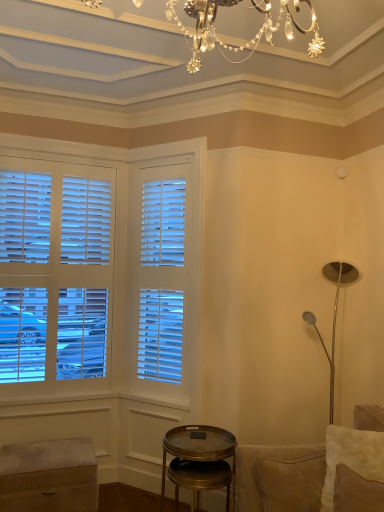
The height and width of the screenshot is (512, 384). Describe the element at coordinates (280, 478) in the screenshot. I see `suede couch at right` at that location.

Locate an element on the screen. metallic gold side table at lower center is located at coordinates (201, 452).

Would you say velvet ottoman at lower left is to the left or to the right of suede couch at right in the picture?

velvet ottoman at lower left is to the left of suede couch at right.

From the image's perspective, would you say velvet ottoman at lower left is positioned over suede couch at right?

No, from the image's perspective, velvet ottoman at lower left is not over suede couch at right.

Is velvet ottoman at lower left situated inside suede couch at right or outside?

The correct answer is: outside.

Choose the correct answer: Is suede couch at right inside velvet ottoman at lower left or outside it?

suede couch at right is spatially situated outside velvet ottoman at lower left.

Between suede couch at right and velvet ottoman at lower left, which one has larger width?

Wider between the two is suede couch at right.

From the picture: From the image's perspective, is suede couch at right under velvet ottoman at lower left?

Incorrect, from the image's perspective, suede couch at right is higher than velvet ottoman at lower left.

How many degrees apart are the facing directions of suede couch at right and velvet ottoman at lower left?

The angular difference between suede couch at right and velvet ottoman at lower left is 89.9 degrees.

Where is `table below the suede couch at right (from the image's perspective)`? This screenshot has height=512, width=384. table below the suede couch at right (from the image's perspective) is located at coordinates (201, 452).

Is metallic gold side table at lower center located within suede couch at right?

That's incorrect, metallic gold side table at lower center is not inside suede couch at right.

Is suede couch at right to the left of metallic gold side table at lower center from the viewer's perspective?

No.

Does suede couch at right touch metallic gold side table at lower center?

No, suede couch at right is not touching metallic gold side table at lower center.

Would you say white fluffy pillow at lower right is outside suede couch at right?

Actually, white fluffy pillow at lower right is within suede couch at right.

From a real-world perspective, is white fluffy pillow at lower right located beneath suede couch at right?

No, from a real-world perspective, white fluffy pillow at lower right is not under suede couch at right.

How different are the orientations of white fluffy pillow at lower right and suede couch at right in degrees?

The angle between the facing direction of white fluffy pillow at lower right and the facing direction of suede couch at right is 37.7 degrees.

Which object is positioned more to the right, white fluffy pillow at lower right or suede couch at right?

From the viewer's perspective, suede couch at right appears more on the right side.

Is white fluffy pillow at lower right located within velvet ottoman at lower left?

No.

From the picture: Considering the sizes of objects velvet ottoman at lower left and white fluffy pillow at lower right in the image provided, who is taller, velvet ottoman at lower left or white fluffy pillow at lower right?

With more height is velvet ottoman at lower left.

Considering the positions of objects velvet ottoman at lower left and white fluffy pillow at lower right in the image provided, who is behind, velvet ottoman at lower left or white fluffy pillow at lower right?

velvet ottoman at lower left is more distant.

Is white fluffy pillow at lower right at the right side of velvet ottoman at lower left?

Indeed, white fluffy pillow at lower right is positioned on the right side of velvet ottoman at lower left.

This screenshot has height=512, width=384. I want to click on pillow on the right of velvet ottoman at lower left, so click(351, 457).

Considering the sizes of objects white fluffy pillow at lower right and velvet ottoman at lower left in the image provided, who is shorter, white fluffy pillow at lower right or velvet ottoman at lower left?

white fluffy pillow at lower right is shorter.

Could you tell me if white fluffy pillow at lower right is facing velvet ottoman at lower left?

No, white fluffy pillow at lower right does not turn towards velvet ottoman at lower left.

From the image's perspective, is suede couch at right beneath white fluffy pillow at lower right?

Indeed, from the image's perspective, suede couch at right is shown beneath white fluffy pillow at lower right.

Looking at their sizes, would you say suede couch at right is wider or thinner than white fluffy pillow at lower right?

In the image, suede couch at right appears to be wider than white fluffy pillow at lower right.

Considering the positions of objects suede couch at right and white fluffy pillow at lower right in the image provided, who is more to the left, suede couch at right or white fluffy pillow at lower right?

Positioned to the left is white fluffy pillow at lower right.

Would you say suede couch at right is inside or outside white fluffy pillow at lower right?

The correct answer is: outside.

Locate an element on the screen. Image resolution: width=384 pixels, height=512 pixels. studio couch above the velvet ottoman at lower left (from a real-world perspective) is located at coordinates (280, 478).

Locate an element on the screen. music stool on the left of the suede couch at right is located at coordinates (49, 476).

Based on their spatial positions, is velvet ottoman at lower left or metallic gold side table at lower center further from suede couch at right?

velvet ottoman at lower left is positioned further to the anchor suede couch at right.

Estimate the real-world distances between objects in this image. Which object is further from velvet ottoman at lower left, suede couch at right or white fluffy pillow at lower right?

white fluffy pillow at lower right lies further to velvet ottoman at lower left than the other object.

Estimate the real-world distances between objects in this image. Which object is further from white fluffy pillow at lower right, suede couch at right or metallic gold side table at lower center?

The object further to white fluffy pillow at lower right is metallic gold side table at lower center.

From the image, which object appears to be nearer to metallic gold side table at lower center, white fluffy pillow at lower right or velvet ottoman at lower left?

→ Among the two, white fluffy pillow at lower right is located nearer to metallic gold side table at lower center.

Looking at this image, looking at the image, which one is located closer to velvet ottoman at lower left, white fluffy pillow at lower right or metallic gold side table at lower center?

The object closer to velvet ottoman at lower left is metallic gold side table at lower center.

Estimate the real-world distances between objects in this image. Which object is further from suede couch at right, metallic gold side table at lower center or white fluffy pillow at lower right?

metallic gold side table at lower center lies further to suede couch at right than the other object.

When comparing their distances from white fluffy pillow at lower right, does velvet ottoman at lower left or metallic gold side table at lower center seem further?

Among the two, velvet ottoman at lower left is located further to white fluffy pillow at lower right.

Considering their positions, is velvet ottoman at lower left positioned closer to metallic gold side table at lower center than white fluffy pillow at lower right?

white fluffy pillow at lower right is positioned closer to the anchor metallic gold side table at lower center.

Image resolution: width=384 pixels, height=512 pixels. I want to click on table located between velvet ottoman at lower left and suede couch at right in the left-right direction, so click(201, 452).

Image resolution: width=384 pixels, height=512 pixels. What are the coordinates of `pillow between velvet ottoman at lower left and suede couch at right in the horizontal direction` in the screenshot? It's located at (351, 457).

At what (x,y) coordinates should I click in order to perform the action: click on pillow between suede couch at right and metallic gold side table at lower center along the z-axis. Please return your answer as a coordinate pair (x, y). Looking at the image, I should click on (351, 457).

Find the location of a particular element. This screenshot has height=512, width=384. table located between velvet ottoman at lower left and white fluffy pillow at lower right in the left-right direction is located at coordinates (201, 452).